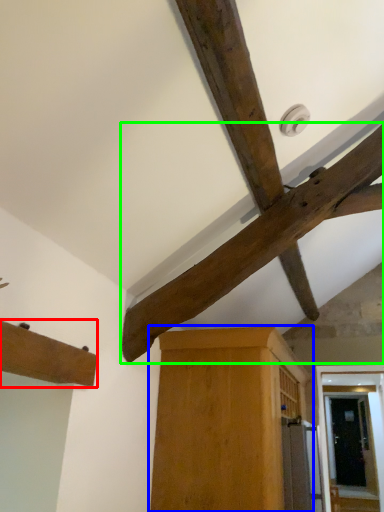
Question: Estimate the real-world distances between objects in this image. Which object is farther from cabinetry (highlighted by a red box), cabinetry (highlighted by a blue box) or beam (highlighted by a green box)?

Choices:
 (A) cabinetry
 (B) beam

Answer: (A)